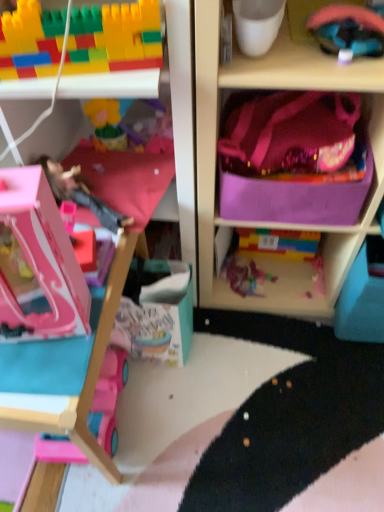
Question: Considering the positions of multicolored plastic blocks at upper left, the 4th toy positioned from the bottom, and pink plastic dollhouse at left in the image, is multicolored plastic blocks at upper left, the 4th toy positioned from the bottom, taller or shorter than pink plastic dollhouse at left?

Choices:
 (A) tall
 (B) short

Answer: (B)

Question: From the image's perspective, is multicolored plastic blocks at upper left, the 4th toy positioned from the bottom, located above or below pink plastic dollhouse at left?

Choices:
 (A) above
 (B) below

Answer: (A)

Question: Estimate the real-world distances between objects in this image. Which object is closer to the multicolored plastic blocks at upper left, which is the second toy in top-to-bottom order?

Choices:
 (A) translucent plastic toy at center, acting as the second toy starting from the bottom
 (B) white matte cup at upper center
 (C) purple fabric storage box at upper right
 (D) pink fabric pillow at center
 (E) pink plastic dollhouse at left

Answer: (B)

Question: Based on their relative distances, which object is farther from the rubberized pink helmet at upper right, marked as the 5th toy in a bottom-to-top arrangement?

Choices:
 (A) translucent plastic toy at center, the 4th toy positioned from the top
 (B) purple fabric storage box at upper right
 (C) white matte cup at upper center
 (D) pink fabric pillow at center
 (E) pink plastic dollhouse at left

Answer: (A)